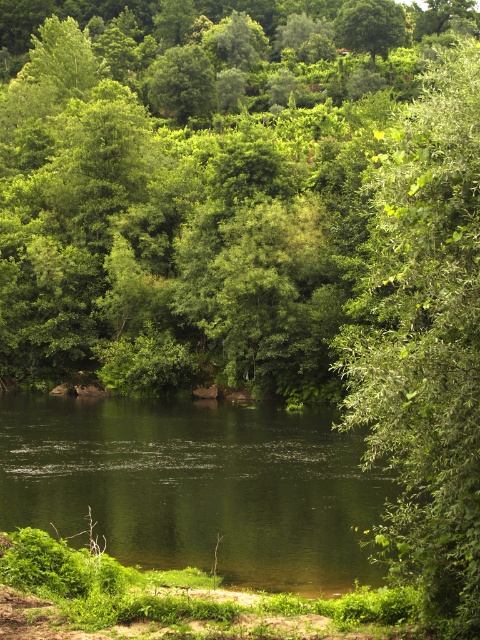
Question: Estimate the real-world distances between objects in this image. Which object is farther from the green leafy tree at center?

Choices:
 (A) green smooth water at center
 (B) green leafy tree at upper center

Answer: (A)

Question: Considering the real-world distances, which object is farthest from the green leafy tree at right?

Choices:
 (A) green leafy tree at center
 (B) green smooth water at center
 (C) green leafy tree at upper center

Answer: (C)

Question: Which object is closer to the camera taking this photo?

Choices:
 (A) green leafy tree at upper center
 (B) green leafy tree at center
 (C) green leafy tree at right

Answer: (C)

Question: Does green leafy tree at center have a greater width compared to green smooth water at center?

Choices:
 (A) yes
 (B) no

Answer: (A)

Question: From the image, what is the correct spatial relationship of green leafy tree at center in relation to green leafy tree at upper center?

Choices:
 (A) above
 (B) below

Answer: (B)

Question: Is green smooth water at center smaller than green leafy tree at right?

Choices:
 (A) yes
 (B) no

Answer: (A)